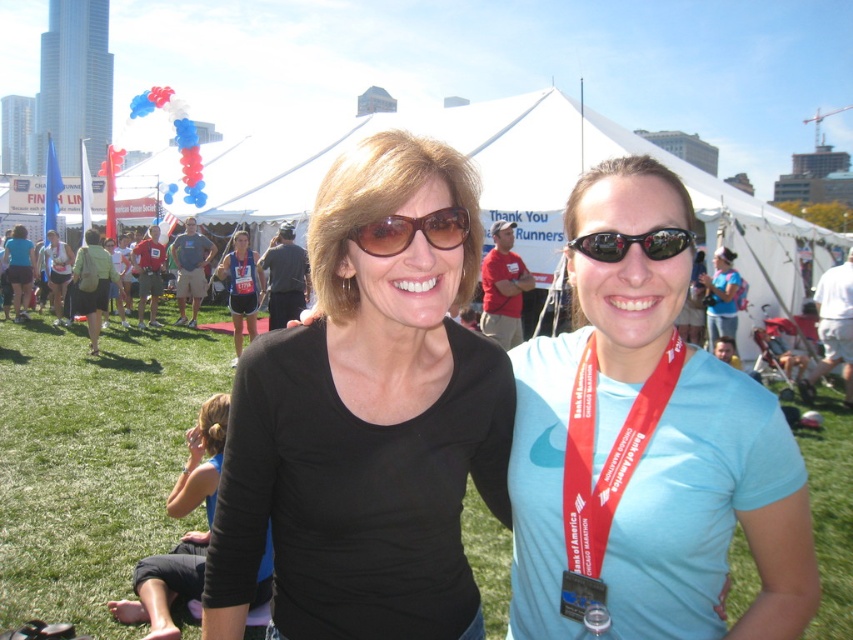
Question: Where is black matte shirt at center located in relation to matte black shorts at lower left in the image?

Choices:
 (A) above
 (B) below

Answer: (B)

Question: Is white fabric tent at center thinner than matte green backpack at left?

Choices:
 (A) yes
 (B) no

Answer: (B)

Question: Among these points, which one is farthest from the camera?

Choices:
 (A) (444, 237)
 (B) (61, 481)
 (C) (572, 426)
 (D) (230, 282)

Answer: (D)

Question: Which of the following is the farthest from the observer?

Choices:
 (A) black matte shirt at center
 (B) light blue fabric shirt at center
 (C) matte blue tank top at center
 (D) green grass at center

Answer: (C)

Question: Does black matte shirt at center appear over green grass at center?

Choices:
 (A) yes
 (B) no

Answer: (A)

Question: Which of these objects is positioned farthest from the red fabric lanyard at center?

Choices:
 (A) matte black shorts at lower left
 (B) matte blue tank top at center

Answer: (A)